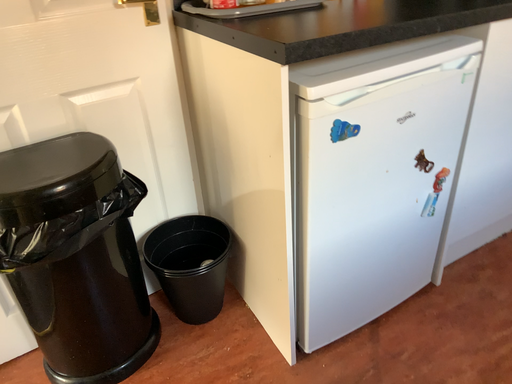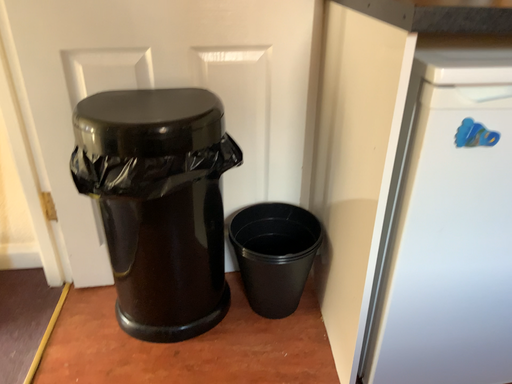
Question: How did the camera likely rotate when shooting the video?

Choices:
 (A) rotated left
 (B) rotated right

Answer: (A)